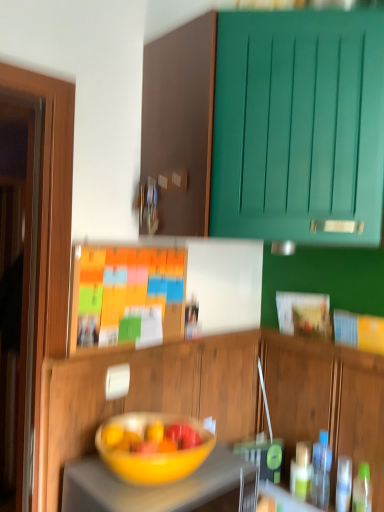
Question: Is matte yellow bowl at center smaller than wooden cabinet at center, which is the 1th cabinetry from bottom to top?

Choices:
 (A) yes
 (B) no

Answer: (A)

Question: Is matte yellow bowl at center bigger than wooden cabinet at center, which is the 2th cabinetry in top-to-bottom order?

Choices:
 (A) no
 (B) yes

Answer: (A)

Question: From the image's perspective, would you say matte yellow bowl at center is positioned over wooden cabinet at center, which is the 1th cabinetry from bottom to top?

Choices:
 (A) yes
 (B) no

Answer: (A)

Question: Does matte yellow bowl at center come behind wooden cabinet at center, which is the 1th cabinetry from bottom to top?

Choices:
 (A) yes
 (B) no

Answer: (B)

Question: Is matte yellow bowl at center touching wooden cabinet at center, which is the 1th cabinetry from bottom to top?

Choices:
 (A) yes
 (B) no

Answer: (B)

Question: Could you tell me if matte yellow bowl at center is facing wooden cabinet at center, which is the 1th cabinetry from bottom to top?

Choices:
 (A) no
 (B) yes

Answer: (A)

Question: Is yellow matte bowl at center next to wooden cabinet at center, which is the 1th cabinetry from bottom to top?

Choices:
 (A) no
 (B) yes

Answer: (A)

Question: Is yellow matte bowl at center at the right side of wooden cabinet at center, which is the 2th cabinetry in top-to-bottom order?

Choices:
 (A) no
 (B) yes

Answer: (B)

Question: From the image's perspective, is yellow matte bowl at center on top of wooden cabinet at center, which is the 2th cabinetry in top-to-bottom order?

Choices:
 (A) yes
 (B) no

Answer: (B)

Question: Is yellow matte bowl at center further to camera compared to wooden cabinet at center, which is the 1th cabinetry from bottom to top?

Choices:
 (A) yes
 (B) no

Answer: (B)

Question: Is yellow matte bowl at center smaller than wooden cabinet at center, which is the 2th cabinetry in top-to-bottom order?

Choices:
 (A) no
 (B) yes

Answer: (A)

Question: Is yellow matte bowl at center wider than wooden cabinet at center, which is the 1th cabinetry from bottom to top?

Choices:
 (A) no
 (B) yes

Answer: (B)

Question: Would you consider wooden cabinet at center, which is the 2th cabinetry in top-to-bottom order, to be distant from matte yellow bowl at center?

Choices:
 (A) no
 (B) yes

Answer: (A)